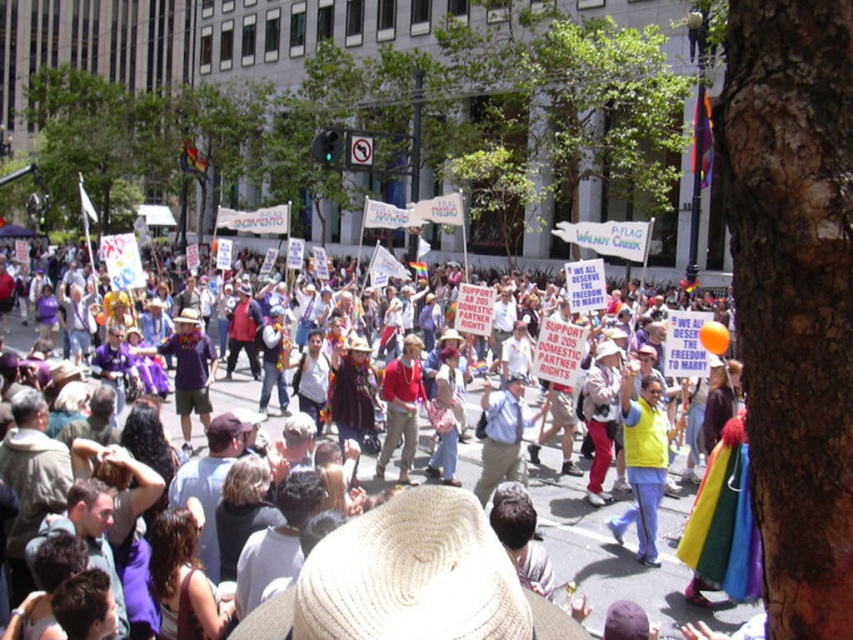
Which is in front, point (448, 618) or point (395, 372)?

Point (448, 618)

This screenshot has width=853, height=640. In order to click on white straw cowboy hat at center in this screenshot , I will do (x=410, y=580).

Which is more to the right, white straw cowboy hat at center or white cotton hat at center?

Positioned to the right is white straw cowboy hat at center.

What do you see at coordinates (410, 580) in the screenshot? The height and width of the screenshot is (640, 853). I see `white straw cowboy hat at center` at bounding box center [410, 580].

The width and height of the screenshot is (853, 640). Identify the location of white straw cowboy hat at center. (410, 580).

Who is taller, white cotton hat at center or red matte shirt at center?

Standing taller between the two is white cotton hat at center.

Can you confirm if white cotton hat at center is positioned to the left of red matte shirt at center?

Indeed, white cotton hat at center is positioned on the left side of red matte shirt at center.

Does point (465, 460) lie in front of point (404, 340)?

No, it is behind (404, 340).

Identify the location of white cotton hat at center. (618, 554).